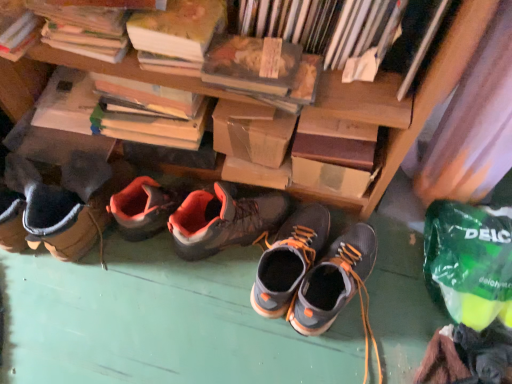
Identify the location of spots to the right of matte gray and orange hiking boots at center, the 3th footwear when ordered from left to right. Image resolution: width=512 pixels, height=384 pixels. (390, 286).